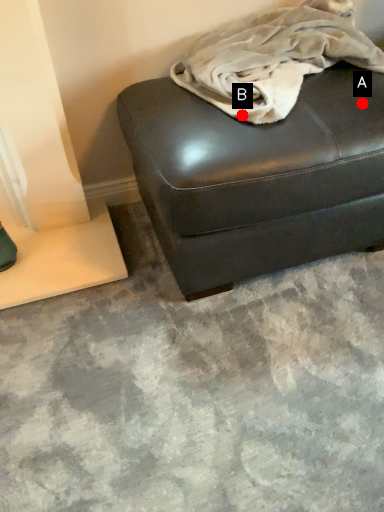
Question: Two points are circled on the image, labeled by A and B beside each circle. Which point is farther from the camera taking this photo?

Choices:
 (A) A is further
 (B) B is further

Answer: (A)